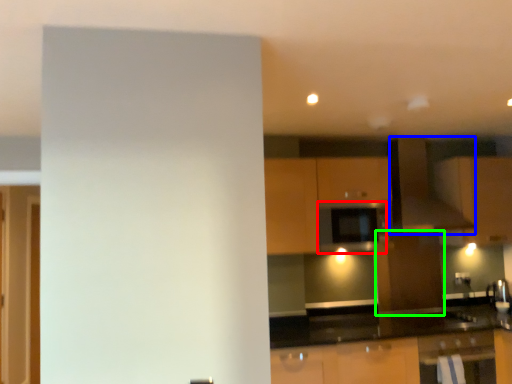
Question: Estimate the real-world distances between objects in this image. Which object is farther from appliance (highlighted by a red box), exhaust hood (highlighted by a blue box) or cabinetry (highlighted by a green box)?

Choices:
 (A) exhaust hood
 (B) cabinetry

Answer: (B)